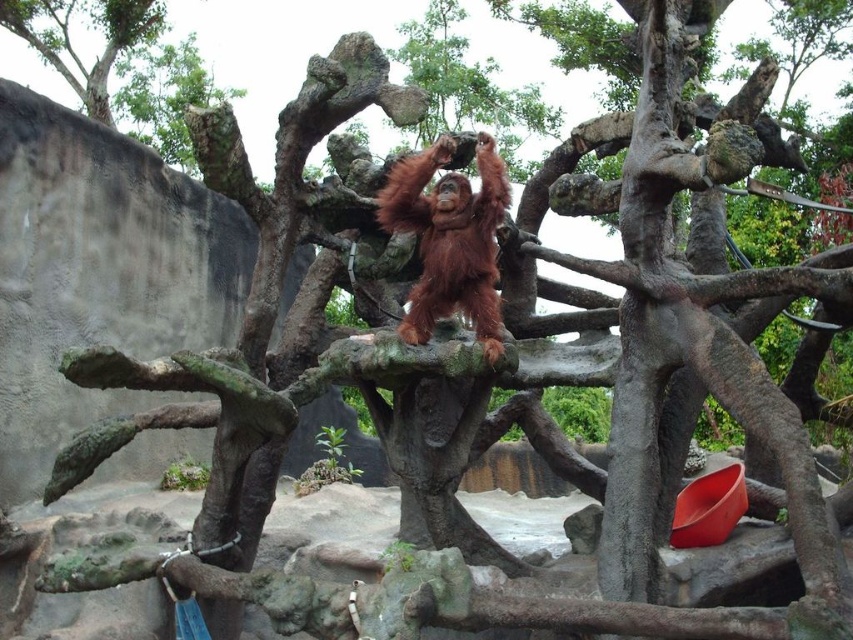
You are a zoo visitor observing the orangutan enclosure. You notice the orange fur orangutan at center and the rough bark tree at upper left. Which object is positioned to the left of the other?

The orange fur orangutan at center is to the right of the rough bark tree at upper left, so the rough bark tree at upper left is positioned to the left of the orange fur orangutan at center.

You are an orangutan in the zoo enclosure. You want to climb from the smooth gray tree trunk at right to the rough bark tree at upper left. Which tree will you reach first if you move forward?

The smooth gray tree trunk at right is in front of the rough bark tree at upper left, so you will reach the smooth gray tree trunk at right first.